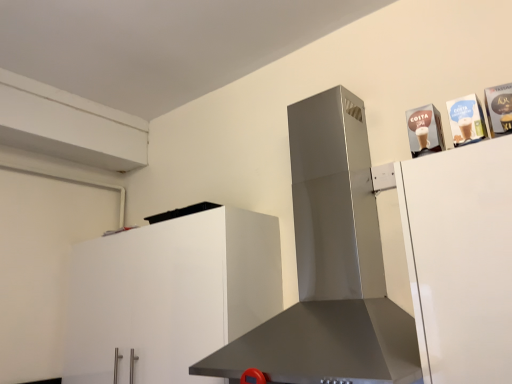
This screenshot has width=512, height=384. I want to click on satin silver range hood at center, so click(x=330, y=266).

What do you see at coordinates (330, 266) in the screenshot?
I see `satin silver range hood at center` at bounding box center [330, 266].

What do you see at coordinates (170, 294) in the screenshot? The height and width of the screenshot is (384, 512). I see `white matte cabinet at lower left` at bounding box center [170, 294].

You are a GUI agent. You are given a task and a screenshot of the screen. Output one action in this format:
    pyautogui.click(x=<x>, y=<y>)
    Task: Click on the white matte cabinet at lower left
    The image size is (512, 384).
    Given the screenshot: What is the action you would take?
    pyautogui.click(x=170, y=294)

At what (x,y) coordinates should I click in order to perform the action: click on satin silver range hood at center. Please return your answer as a coordinate pair (x, y). The width and height of the screenshot is (512, 384). Looking at the image, I should click on (330, 266).

Looking at this image, based on their positions, is white matte cabinet at lower left located to the left or right of satin silver range hood at center?

white matte cabinet at lower left is to the left of satin silver range hood at center.

Is white matte cabinet at lower left behind satin silver range hood at center?

Yes, white matte cabinet at lower left is further from the viewer.

Which is behind, point (182, 362) or point (347, 90)?

The point (347, 90) is farther from the camera.

From the image's perspective, between white matte cabinet at lower left and satin silver range hood at center, which one is located above?

satin silver range hood at center appears higher in the image.

From a real-world perspective, is white matte cabinet at lower left on top of satin silver range hood at center?

Actually, white matte cabinet at lower left is physically below satin silver range hood at center in the real world.

Considering the relative sizes of white matte cabinet at lower left and satin silver range hood at center in the image provided, is white matte cabinet at lower left thinner than satin silver range hood at center?

Yes, white matte cabinet at lower left is thinner than satin silver range hood at center.

In terms of height, does white matte cabinet at lower left look taller or shorter compared to satin silver range hood at center?

Considering their sizes, white matte cabinet at lower left has less height than satin silver range hood at center.

From the picture: Does white matte cabinet at lower left have a larger size compared to satin silver range hood at center?

Actually, white matte cabinet at lower left might be smaller than satin silver range hood at center.

Is satin silver range hood at center surrounded by white matte cabinet at lower left?

No, satin silver range hood at center is not inside white matte cabinet at lower left.

Would you say white matte cabinet at lower left is a long distance from satin silver range hood at center?

Yes, white matte cabinet at lower left is far from satin silver range hood at center.

Looking at this image, is white matte cabinet at lower left facing away from satin silver range hood at center?

No, white matte cabinet at lower left is not facing away from satin silver range hood at center.

How different are the orientations of white matte cabinet at lower left and satin silver range hood at center in degrees?

The facing directions of white matte cabinet at lower left and satin silver range hood at center are 0.000412 degrees apart.

Locate an element on the screen. Image resolution: width=512 pixels, height=384 pixels. cabinetry below the satin silver range hood at center (from the image's perspective) is located at coordinates (170, 294).

Is satin silver range hood at center to the left of white matte cabinet at lower left from the viewer's perspective?

No.

Which object is closer to the camera taking this photo, satin silver range hood at center or white matte cabinet at lower left?

Positioned in front is satin silver range hood at center.

Is point (321, 206) less distant than point (186, 337)?

No, it is not.

From the image's perspective, between satin silver range hood at center and white matte cabinet at lower left, who is located below?

white matte cabinet at lower left, from the image's perspective.

From a real-world perspective, which object rests below the other?

white matte cabinet at lower left.

Between satin silver range hood at center and white matte cabinet at lower left, which one has larger width?

With larger width is satin silver range hood at center.

Does satin silver range hood at center have a lesser height compared to white matte cabinet at lower left?

No, satin silver range hood at center is not shorter than white matte cabinet at lower left.

In the scene shown: Who is smaller, satin silver range hood at center or white matte cabinet at lower left?

With smaller size is white matte cabinet at lower left.

Can we say satin silver range hood at center lies outside white matte cabinet at lower left?

Indeed, satin silver range hood at center is completely outside white matte cabinet at lower left.

Would you say satin silver range hood at center is a long distance from white matte cabinet at lower left?

satin silver range hood at center is positioned a significant distance from white matte cabinet at lower left.

Is satin silver range hood at center oriented towards white matte cabinet at lower left?

No, satin silver range hood at center is not turned towards white matte cabinet at lower left.

I want to click on cabinetry behind the satin silver range hood at center, so click(170, 294).

At what (x,y) coordinates should I click in order to perform the action: click on home appliance on the right of white matte cabinet at lower left. Please return your answer as a coordinate pair (x, y). Looking at the image, I should click on (330, 266).

This screenshot has height=384, width=512. In the image, there is a satin silver range hood at center. In order to click on cabinetry below it (from the image's perspective) in this screenshot , I will do `click(170, 294)`.